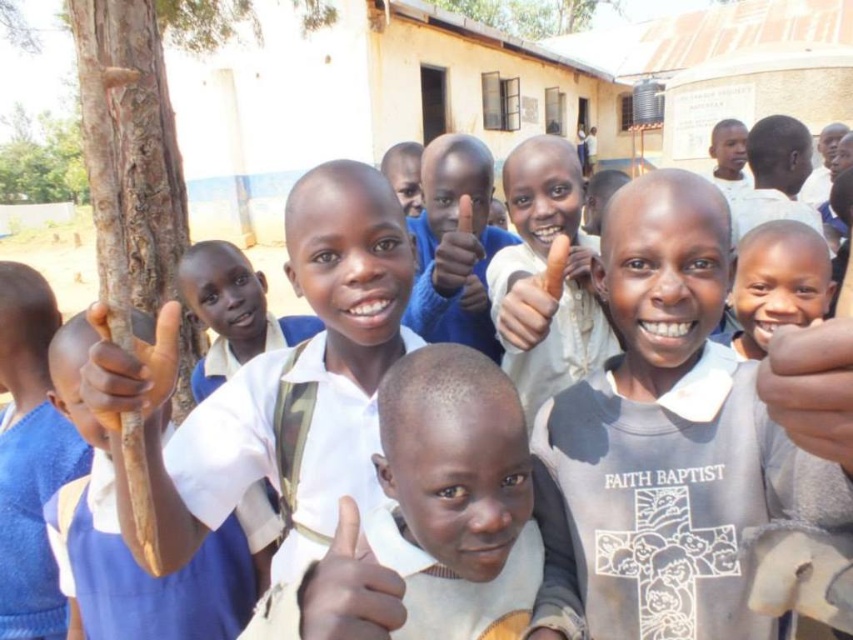
You are a photographer standing 2 meters away from the tree trunk on the left. You want to take a photo that includes both the smooth skin hand at center and the dark skin hand at center. Can you fit both hands in the frame without moving your position?

The distance between the smooth skin hand at center and the dark skin hand at center is 1.09 meters. Since you are 2 meters away from the tree trunk, your camera likely has a wide enough angle to capture both hands within the frame without needing to move.

You are a student in the image and want to pick up the brown rough stick at left. Where should you look to find it?

The brown rough stick at left is located at point [131,371], so you should look there to find it.